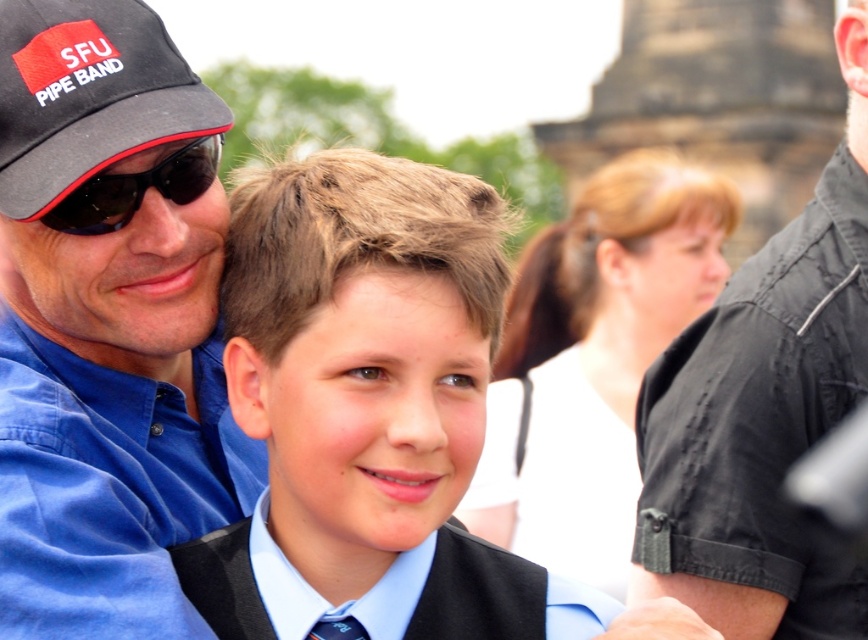
What are the coordinates of the matte black vest at center?

The matte black vest at center is located at point (365,406).